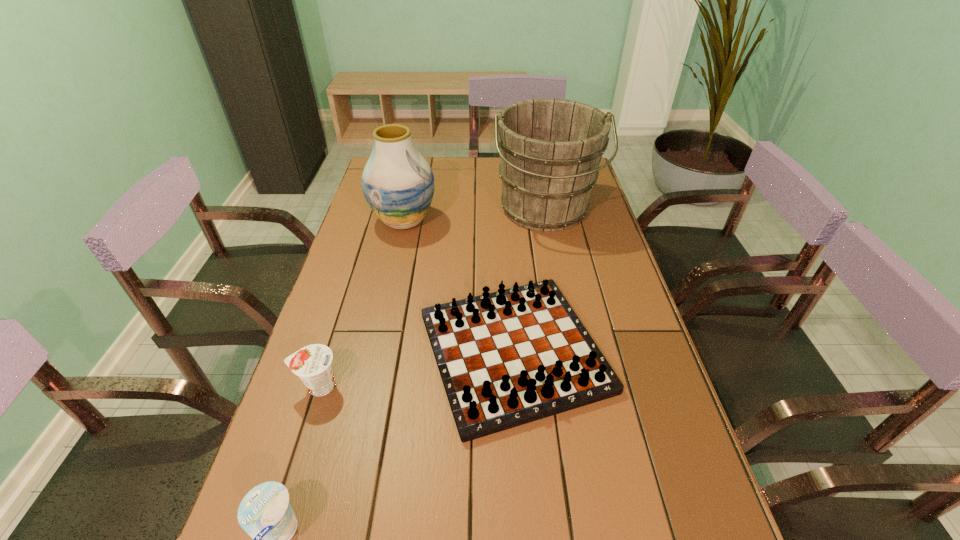
Where is `bucket`? The width and height of the screenshot is (960, 540). bucket is located at coordinates (550, 150).

Identify the location of vase. This screenshot has height=540, width=960. (x=398, y=184).

The image size is (960, 540). I want to click on chessboard, so click(x=507, y=358).

The height and width of the screenshot is (540, 960). I want to click on the farther yogurt, so click(x=313, y=364).

You are a GUI agent. You are given a task and a screenshot of the screen. Output one action in this format:
    pyautogui.click(x=<x>, y=<y>)
    Task: Click on the vacant position located on the handle side of the bucket
    This screenshot has width=960, height=540.
    Given the screenshot: What is the action you would take?
    [564, 308]

Where is `vacant position located 0.130m on the front of the vase`? The height and width of the screenshot is (540, 960). vacant position located 0.130m on the front of the vase is located at coordinates (394, 267).

Find the location of a particular element. vacant region located 0.370m on the back of the chessboard is located at coordinates (504, 213).

The image size is (960, 540). What are the coordinates of `vacant space located 0.380m on the right of the farther yogurt` in the screenshot? It's located at (506, 386).

Find the location of a particular element. Image resolution: width=960 pixels, height=540 pixels. object that is at the far edge is located at coordinates (550, 150).

Where is `vase positioned at the left edge`? This screenshot has width=960, height=540. vase positioned at the left edge is located at coordinates (398, 184).